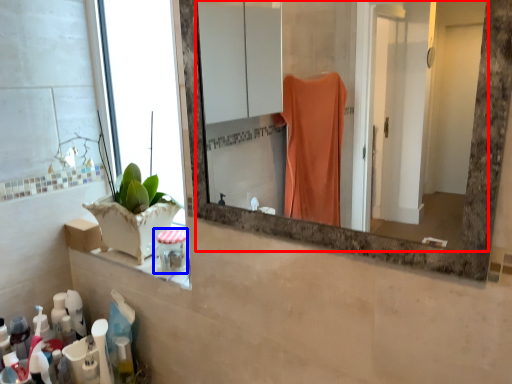
Question: Which object is further to the camera taking this photo, mirror (highlighted by a red box) or toiletry (highlighted by a blue box)?

Choices:
 (A) mirror
 (B) toiletry

Answer: (B)